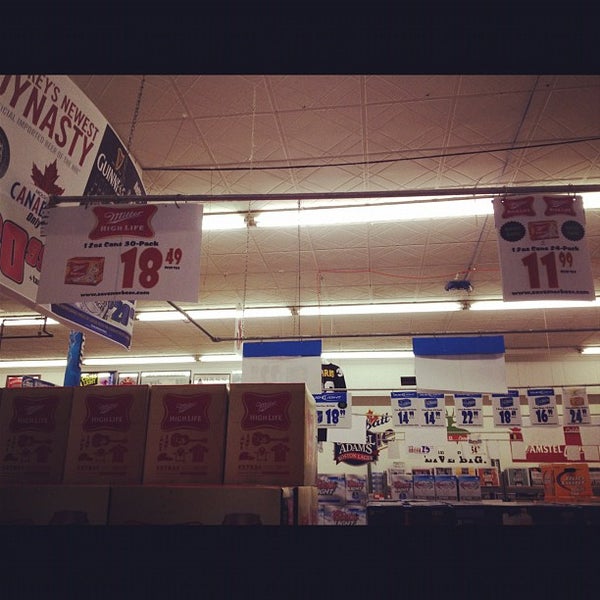
Identify the location of ceiling light strip. The image size is (600, 600). (348, 204), (363, 354), (348, 306).